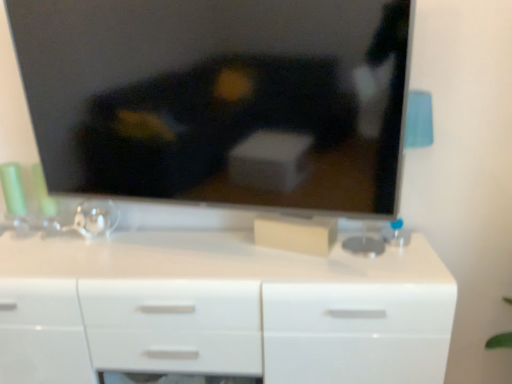
Question: From their relative heights in the image, would you say white glossy chest of drawers at center is taller or shorter than matte black tv at upper center?

Choices:
 (A) tall
 (B) short

Answer: (A)

Question: Relative to matte black tv at upper center, is white glossy chest of drawers at center in front or behind?

Choices:
 (A) behind
 (B) front

Answer: (A)

Question: From a real-world perspective, relative to matte black tv at upper center, is white glossy chest of drawers at center vertically above or below?

Choices:
 (A) above
 (B) below

Answer: (B)

Question: Is matte black tv at upper center bigger or smaller than white glossy chest of drawers at center?

Choices:
 (A) small
 (B) big

Answer: (A)

Question: From the image's perspective, relative to white glossy chest of drawers at center, is matte black tv at upper center above or below?

Choices:
 (A) below
 (B) above

Answer: (B)

Question: Is matte black tv at upper center to the left or to the right of white glossy chest of drawers at center in the image?

Choices:
 (A) right
 (B) left

Answer: (A)

Question: In terms of height, does matte black tv at upper center look taller or shorter compared to white glossy chest of drawers at center?

Choices:
 (A) tall
 (B) short

Answer: (B)